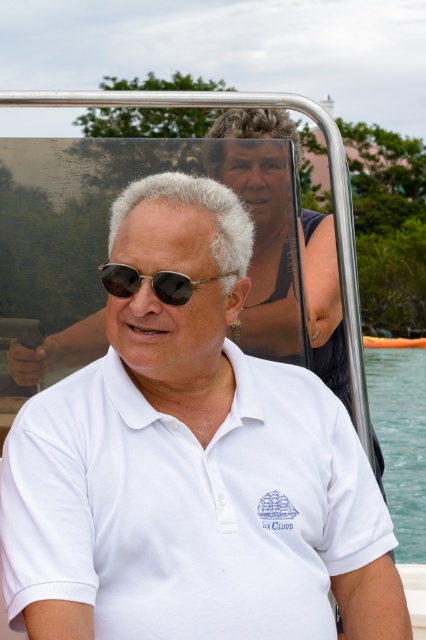
Can you confirm if white cotton polo shirt at center is wider than clear water at lower right?

Incorrect, white cotton polo shirt at center's width does not surpass clear water at lower right's.

Image resolution: width=426 pixels, height=640 pixels. What do you see at coordinates (190, 465) in the screenshot? I see `white cotton polo shirt at center` at bounding box center [190, 465].

Find the location of a particular element. This screenshot has width=426, height=640. white cotton polo shirt at center is located at coordinates (190, 465).

In the scene shown: Between white cotton polo shirt at center and shiny black sunglasses at center, which one appears on the left side from the viewer's perspective?

shiny black sunglasses at center

Which is behind, point (157, 211) or point (184, 275)?

Positioned behind is point (157, 211).

Who is more forward, (x=155, y=524) or (x=111, y=266)?

Point (x=155, y=524) is more forward.

This screenshot has width=426, height=640. What are the coordinates of `white cotton polo shirt at center` in the screenshot? It's located at (190, 465).

Does clear water at lower right appear on the right side of shiny black sunglasses at center?

Indeed, clear water at lower right is positioned on the right side of shiny black sunglasses at center.

Looking at this image, is clear water at lower right to the left of shiny black sunglasses at center from the viewer's perspective?

In fact, clear water at lower right is to the right of shiny black sunglasses at center.

Which is in front, point (408, 428) or point (104, 266)?

Point (104, 266)

You are a GUI agent. You are given a task and a screenshot of the screen. Output one action in this format:
    pyautogui.click(x=<x>, y=<y>)
    Task: Click on the clear water at lower right
    
    Given the screenshot: What is the action you would take?
    pyautogui.click(x=400, y=440)